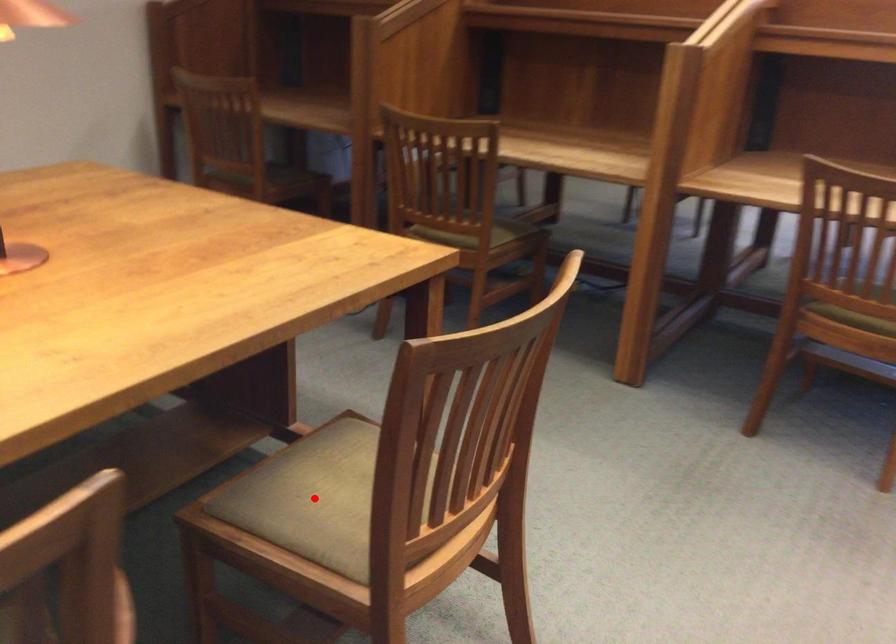
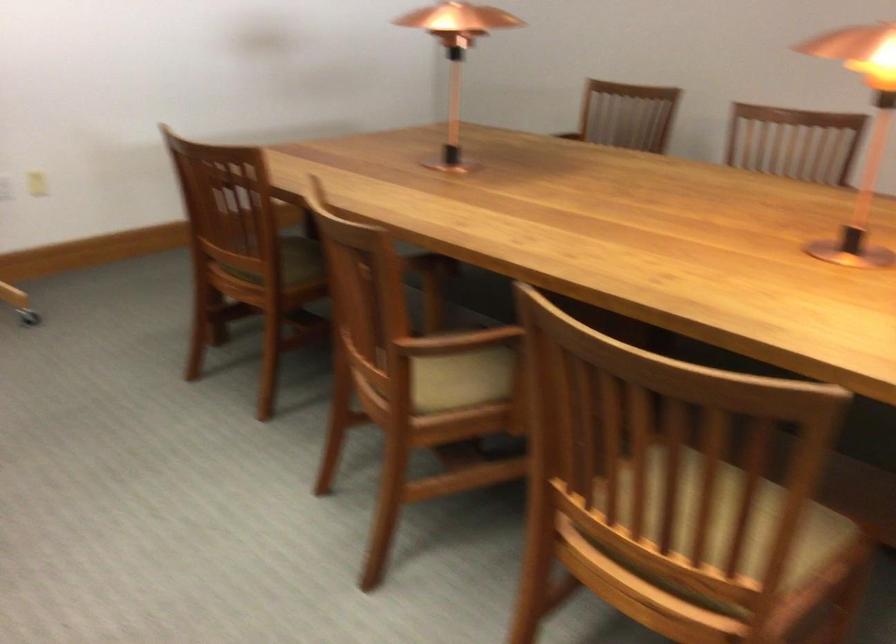
Question: I am providing you with two images of the same scene from different viewpoints. A red point is marked on the first image. Is the red point's position out of view in image 2?

Choices:
 (A) Yes
 (B) No

Answer: (A)